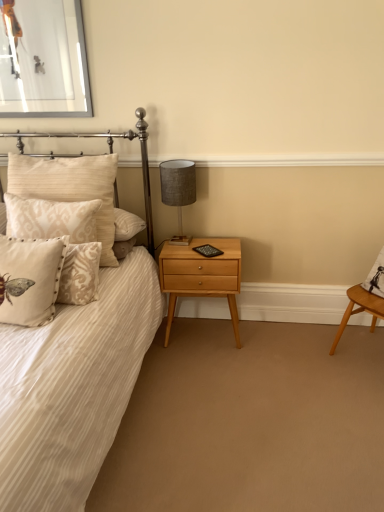
Question: Considering the relative sizes of light wood/texture nightstand at lower center and white striped fabric bed at left in the image provided, is light wood/texture nightstand at lower center shorter than white striped fabric bed at left?

Choices:
 (A) no
 (B) yes

Answer: (B)

Question: Considering the relative sizes of light wood/texture nightstand at lower center and white striped fabric bed at left in the image provided, is light wood/texture nightstand at lower center smaller than white striped fabric bed at left?

Choices:
 (A) no
 (B) yes

Answer: (B)

Question: Is light wood/texture nightstand at lower center outside of white striped fabric bed at left?

Choices:
 (A) yes
 (B) no

Answer: (A)

Question: Is light wood/texture nightstand at lower center closer to camera compared to white striped fabric bed at left?

Choices:
 (A) yes
 (B) no

Answer: (B)

Question: Can you confirm if light wood/texture nightstand at lower center is thinner than white striped fabric bed at left?

Choices:
 (A) no
 (B) yes

Answer: (B)

Question: Is beige textured pillow at left, arranged as the 3th pillow when viewed from the front, wider or thinner than light wood/texture nightstand at lower center?

Choices:
 (A) thin
 (B) wide

Answer: (B)

Question: From the image's perspective, is beige textured pillow at left, the 1th pillow from the back, above or below light wood/texture nightstand at lower center?

Choices:
 (A) above
 (B) below

Answer: (A)

Question: Considering their positions, is beige textured pillow at left, the 1th pillow from the back, located in front of or behind light wood/texture nightstand at lower center?

Choices:
 (A) behind
 (B) front

Answer: (B)

Question: Looking at the image, does beige textured pillow at left, the 1th pillow from the back, seem bigger or smaller compared to light wood/texture nightstand at lower center?

Choices:
 (A) small
 (B) big

Answer: (B)

Question: From the image's perspective, is textured gray lampshade at upper right located above or below beige textured pillow at left, the 1th pillow from the back?

Choices:
 (A) below
 (B) above

Answer: (B)

Question: Does point (173, 188) appear closer or farther from the camera than point (29, 168)?

Choices:
 (A) farther
 (B) closer

Answer: (A)

Question: Choose the correct answer: Is textured gray lampshade at upper right inside beige textured pillow at left, arranged as the 3th pillow when viewed from the front, or outside it?

Choices:
 (A) inside
 (B) outside

Answer: (B)

Question: Based on their sizes in the image, would you say textured gray lampshade at upper right is bigger or smaller than beige textured pillow at left, the 1th pillow from the back?

Choices:
 (A) small
 (B) big

Answer: (A)

Question: Is beige velvet pillow at left, the 2th pillow when ordered from back to front, taller or shorter than beige textured pillow at left, arranged as the 3th pillow when viewed from the front?

Choices:
 (A) short
 (B) tall

Answer: (A)

Question: Looking at their shapes, would you say beige velvet pillow at left, which is the 2th pillow in front-to-back order, is wider or thinner than beige textured pillow at left, arranged as the 3th pillow when viewed from the front?

Choices:
 (A) wide
 (B) thin

Answer: (B)